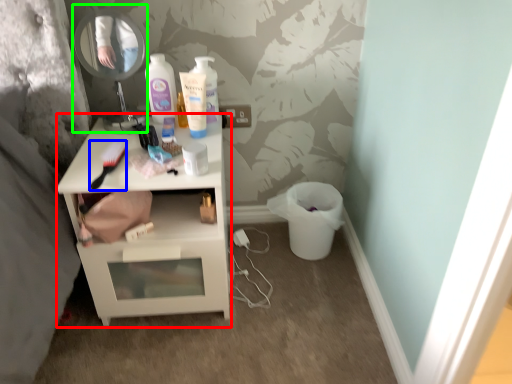
Question: Which object is the closest to the nightstand (highlighted by a red box)? Choose among these: brush (highlighted by a blue box) or mirror (highlighted by a green box).

Choices:
 (A) brush
 (B) mirror

Answer: (A)